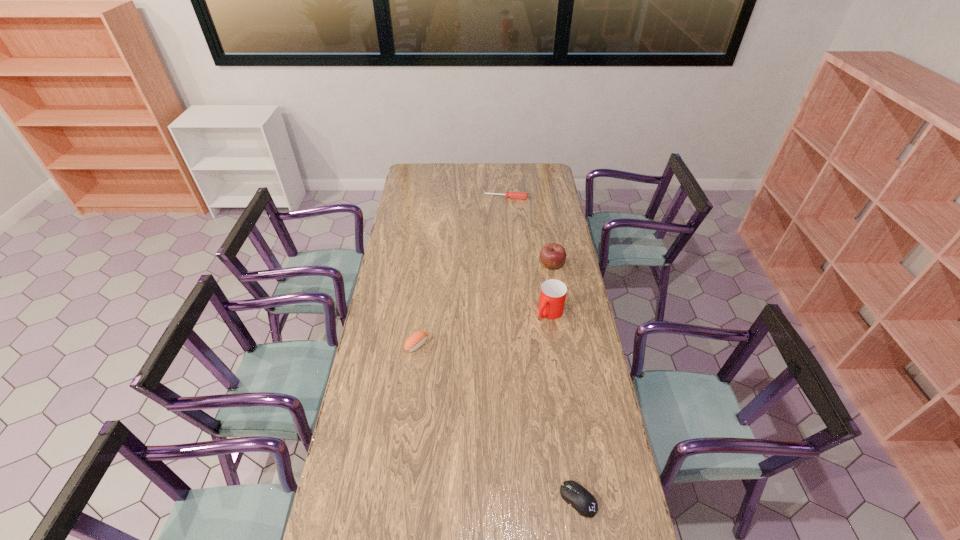
Locate an element on the screen. This screenshot has width=960, height=540. vacant area that lies between the leftmost object and the computer equipment is located at coordinates (497, 422).

Where is `vacant point located between the fourth shortest object and the third tallest object`? vacant point located between the fourth shortest object and the third tallest object is located at coordinates (484, 305).

You are a GUI agent. You are given a task and a screenshot of the screen. Output one action in this format:
    pyautogui.click(x=<x>, y=<y>)
    Task: Click on the free area in between the farthest object and the third tallest object
    This screenshot has width=960, height=540.
    Given the screenshot: What is the action you would take?
    pyautogui.click(x=462, y=271)

Where is `empty space that is in between the cup and the farthest object`? The width and height of the screenshot is (960, 540). empty space that is in between the cup and the farthest object is located at coordinates (528, 255).

The height and width of the screenshot is (540, 960). I want to click on unoccupied position between the screwdriver and the cup, so click(x=528, y=255).

This screenshot has height=540, width=960. What are the coordinates of `vacant space that's between the fourth nearest object and the farthest object` in the screenshot? It's located at (529, 231).

In order to click on vacant area that lies between the leftmost object and the screwdriver in this screenshot , I will do `click(462, 271)`.

You are a GUI agent. You are given a task and a screenshot of the screen. Output one action in this format:
    pyautogui.click(x=<x>, y=<y>)
    Task: Click on the empty space between the computer equipment and the sushi
    Image resolution: width=960 pixels, height=540 pixels.
    Given the screenshot: What is the action you would take?
    pyautogui.click(x=497, y=422)

Image resolution: width=960 pixels, height=540 pixels. Identify the location of blank region between the nearest object and the cup. (564, 406).

Locate which object ranks third in proximity to the leftmost object. Please provide its 2D coordinates. Your answer should be formatted as a tuple, i.e. [(x, y)], where the tuple contains the x and y coordinates of a point satisfying the conditions above.

[(574, 494)]